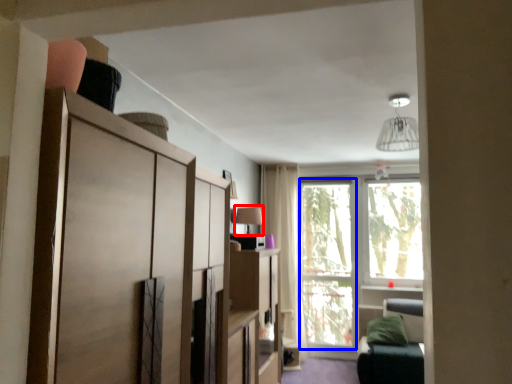
Question: Which object appears closest to the camera in this image, lamp (highlighted by a red box) or window screen (highlighted by a blue box)?

Choices:
 (A) lamp
 (B) window screen

Answer: (A)